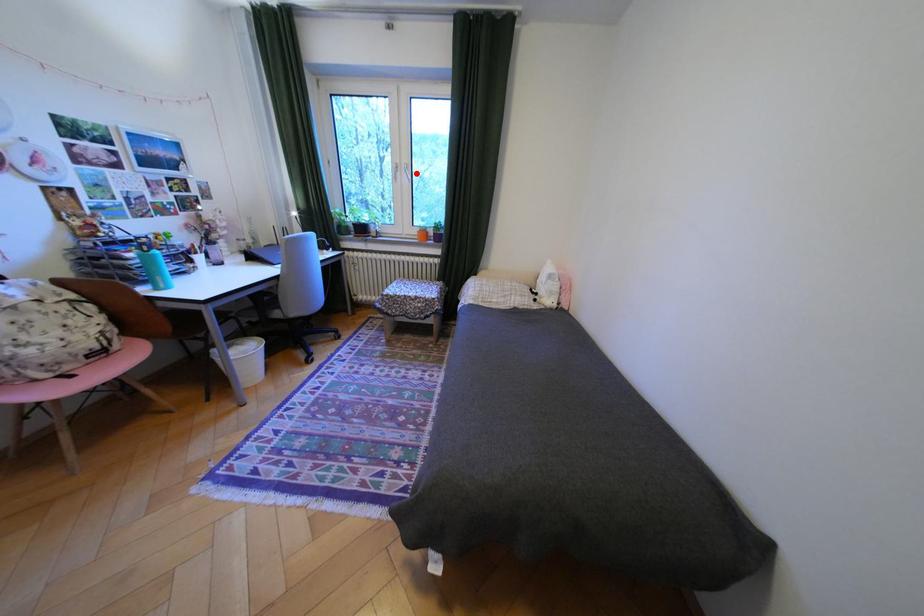
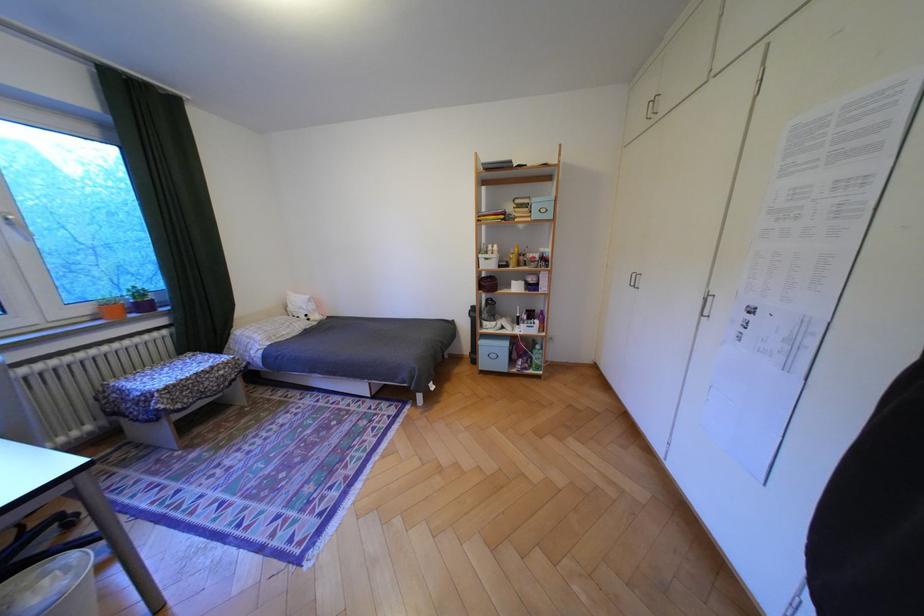
In the second image, find the point that corresponds to the highlighted location in the first image.

(18, 227)